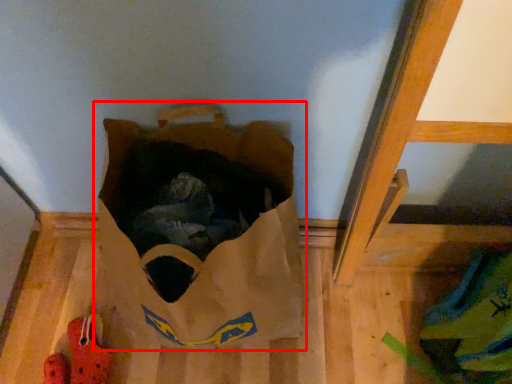
Question: In this image, where is grocery bag (annotated by the red box) located relative to footwear?

Choices:
 (A) left
 (B) right

Answer: (B)